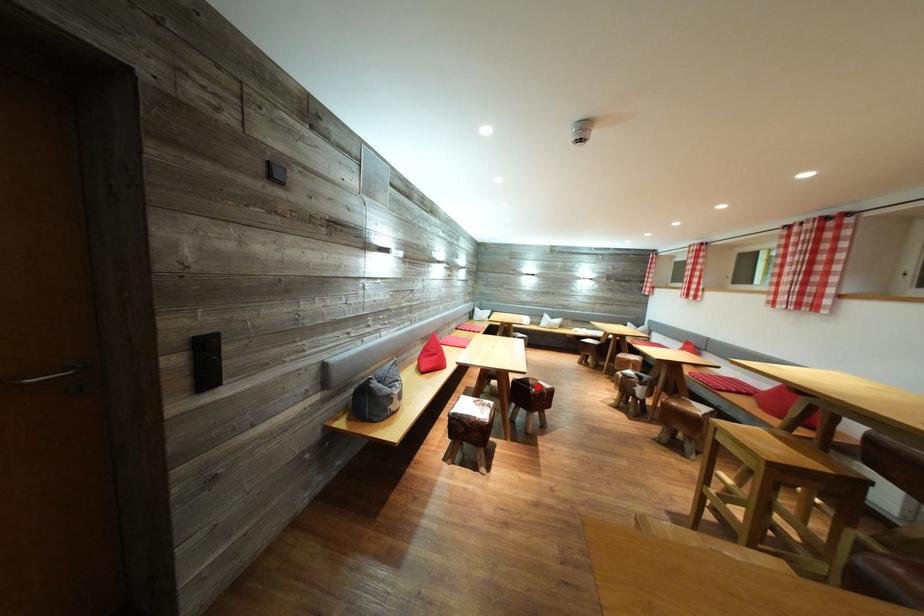
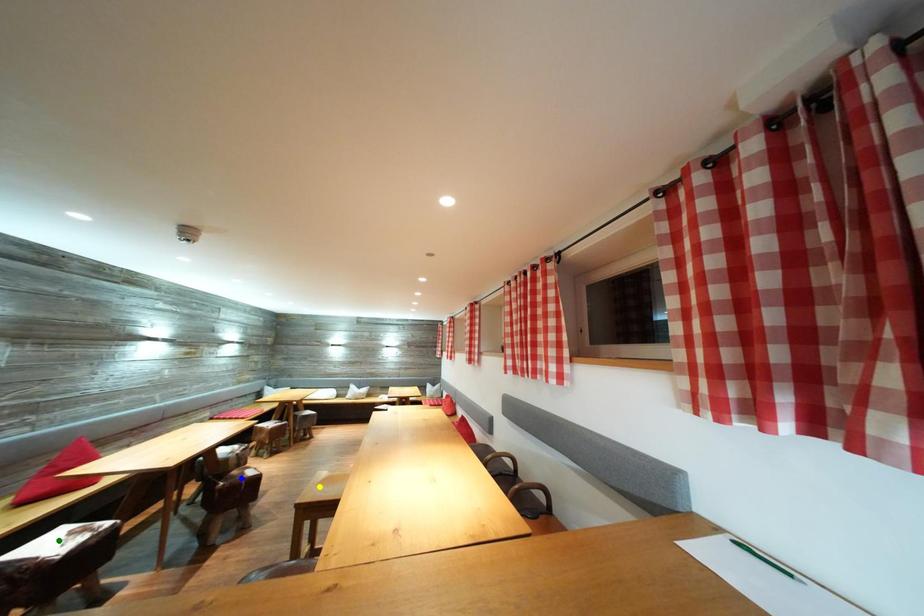
Question: I am providing you with two images of the same scene from different viewpoints. A red point is marked on the first image. You are given multiple points on the second image. In image 2, which mark is for the same physical point as the one in image 1?

Choices:
 (A) yellow point
 (B) blue point
 (C) green point

Answer: (B)